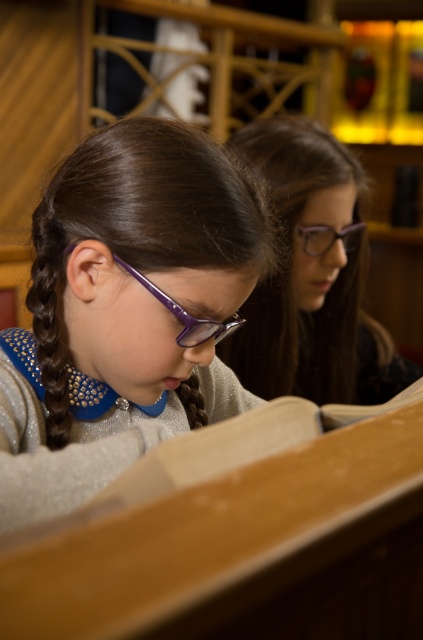
Can you confirm if brown shiny hair braid at left is wider than brown braided hair at center?

Indeed, brown shiny hair braid at left has a greater width compared to brown braided hair at center.

Is brown shiny hair braid at left to the left of brown braided hair at center from the viewer's perspective?

Indeed, brown shiny hair braid at left is positioned on the left side of brown braided hair at center.

Is point (52, 339) closer to viewer compared to point (186, 385)?

Yes, it is.

Identify the location of brown shiny hair braid at left. Image resolution: width=423 pixels, height=640 pixels. (52, 300).

Does point (324, 225) lie in front of point (181, 384)?

No.

Measure the distance between purple plastic glasses at upper center and camera.

They are 4.17 feet apart.

I want to click on purple plastic glasses at upper center, so click(329, 237).

Is brown shiny hair braid at left taller than purple acetate glasses at center?

Yes, brown shiny hair braid at left is taller than purple acetate glasses at center.

Does brown shiny hair braid at left have a smaller size compared to purple acetate glasses at center?

No.

This screenshot has width=423, height=640. What do you see at coordinates (52, 300) in the screenshot?
I see `brown shiny hair braid at left` at bounding box center [52, 300].

The width and height of the screenshot is (423, 640). In order to click on brown shiny hair braid at left in this screenshot , I will do `click(52, 300)`.